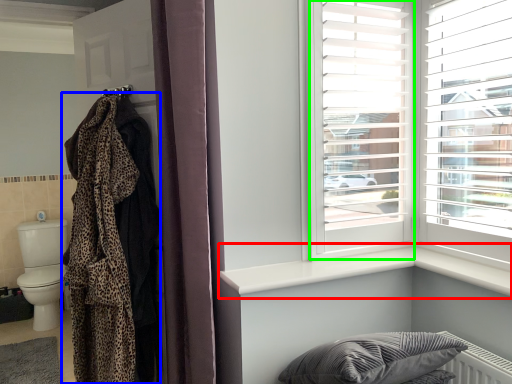
Question: Which object is positioned closest to window sill (highlighted by a red box)? Select from blanket (highlighted by a blue box) and window frame (highlighted by a green box).

Choices:
 (A) blanket
 (B) window frame

Answer: (B)